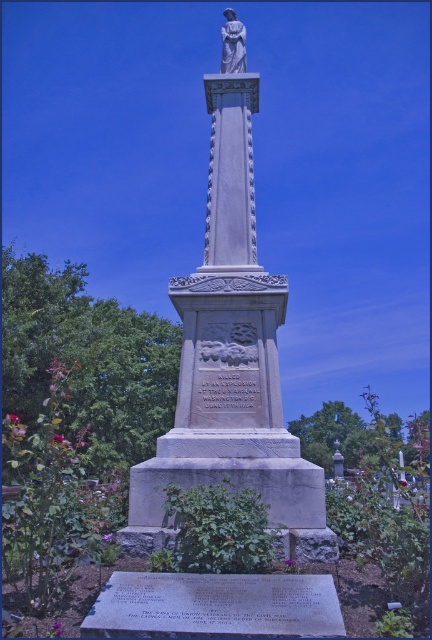
Can you confirm if gray stone monument at center is thinner than white marble statue at upper center?

Yes.

Is gray stone monument at center smaller than white marble statue at upper center?

Yes.

At what (x,y) coordinates should I click in order to perform the action: click on gray stone monument at center. Please return your answer as a coordinate pair (x, y). The width and height of the screenshot is (432, 640). Looking at the image, I should click on (231, 364).

Locate an element on the screen. The height and width of the screenshot is (640, 432). gray stone monument at center is located at coordinates (231, 364).